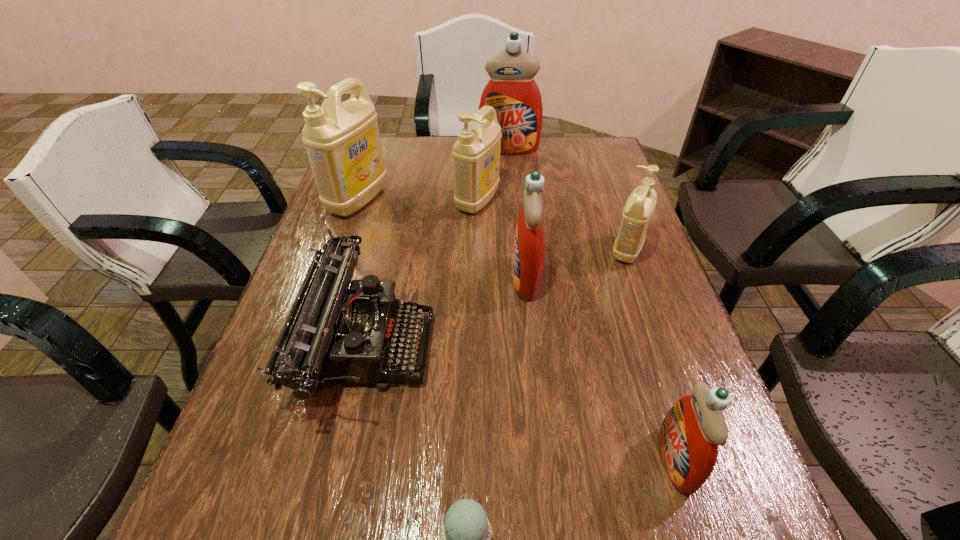
The height and width of the screenshot is (540, 960). Find the location of `the biggest beige detergent`. the biggest beige detergent is located at coordinates (342, 140).

Where is `the leftmost beige detergent`? the leftmost beige detergent is located at coordinates click(x=342, y=140).

Locate an element on the screen. the farthest object is located at coordinates (513, 93).

Locate an element on the screen. This screenshot has width=960, height=540. the biggest red detergent is located at coordinates pos(513,93).

What are the coordinates of `the second nearest red detergent` in the screenshot? It's located at (528, 247).

At what (x,y) coordinates should I click in order to perform the action: click on the second biggest beige detergent. Please return your answer as a coordinate pair (x, y). Image resolution: width=960 pixels, height=540 pixels. Looking at the image, I should click on coord(476,155).

You are a GUI agent. You are given a task and a screenshot of the screen. Output one action in this format:
    pyautogui.click(x=<x>, y=<y>)
    Task: Click on the rightmost beige detergent
    
    Given the screenshot: What is the action you would take?
    pyautogui.click(x=640, y=205)

Locate an element on the screen. the smallest beige detergent is located at coordinates (640, 205).

The width and height of the screenshot is (960, 540). I want to click on the nearest detergent, so click(689, 435).

Where is `the rightmost red detergent`? the rightmost red detergent is located at coordinates (689, 435).